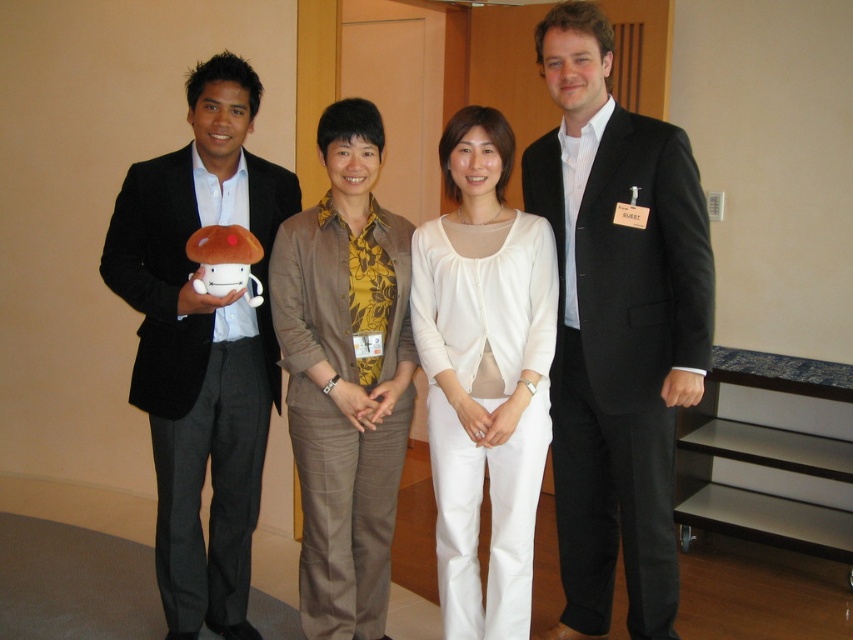
Question: Does matte black suit at left have a greater width compared to matte black suit at center?

Choices:
 (A) no
 (B) yes

Answer: (B)

Question: Can you confirm if white matte blouse at center is thinner than matte black suit at center?

Choices:
 (A) no
 (B) yes

Answer: (A)

Question: Which point is farther to the camera?

Choices:
 (A) black suit at center
 (B) matte black suit at center
 (C) white matte blouse at center
 (D) matte black suit at left

Answer: (B)

Question: Which object is the farthest from the black suit at center?

Choices:
 (A) white matte blouse at center
 (B) matte black suit at left

Answer: (B)

Question: Where is matte black suit at left located in relation to matte black suit at center in the image?

Choices:
 (A) above
 (B) below

Answer: (A)

Question: Among these points, which one is farthest from the camera?

Choices:
 (A) (508, 147)
 (B) (695, 348)

Answer: (A)